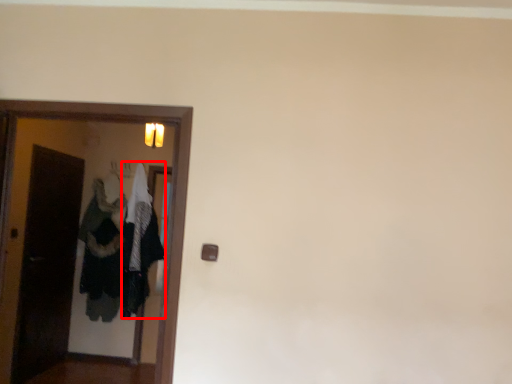
Question: From the image's perspective, considering the relative positions of clothing (annotated by the red box) and door in the image provided, where is clothing (annotated by the red box) located with respect to the staircase?

Choices:
 (A) below
 (B) above

Answer: (A)